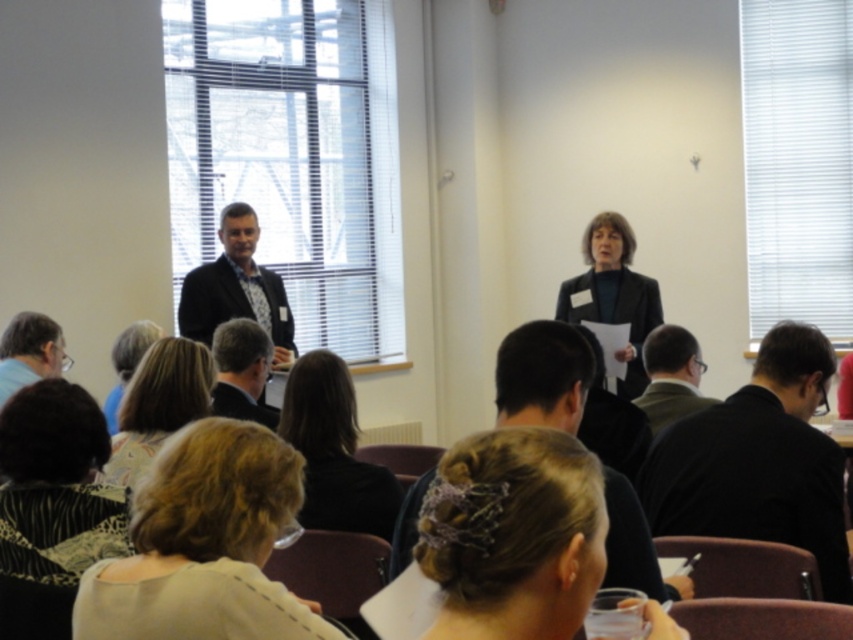
You are an event planner setting up a camera to capture both the dark suit at center and the light brown hair at lower left. Since you want the camera to focus on the taller individual, where should you position the camera?

The dark suit at center is taller than the light brown hair at lower left, so position the camera to focus on the dark suit at center.

You are an attendee sitting in the front row of the dark maroon chairs. You need to hand a document to the dark suit at center during the presentation. Based on their position, can you reach them without leaving your seat?

The dark suit at center is located at point (543, 376), which likely places them within a reasonable distance from the front row. However, without knowing the exact dimensions of the room or the spacing between seats, it is uncertain if you can reach them without leaving your seat. It might be safer to ask someone to pass it along or approach them after the presentation.